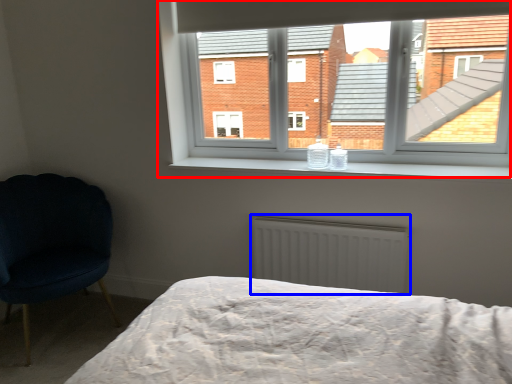
Question: Which object appears closest to the camera in this image, window (highlighted by a red box) or radiator (highlighted by a blue box)?

Choices:
 (A) window
 (B) radiator

Answer: (A)